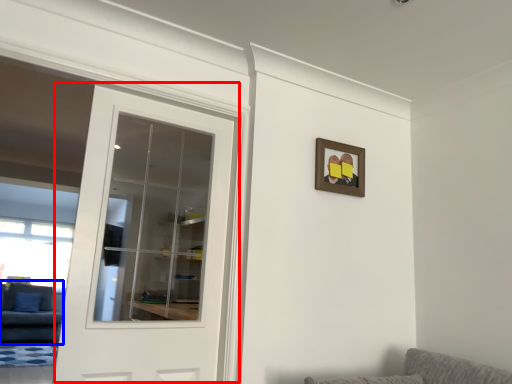
Question: Among these objects, which one is nearest to the camera, door (highlighted by a red box) or couch (highlighted by a blue box)?

Choices:
 (A) door
 (B) couch

Answer: (A)